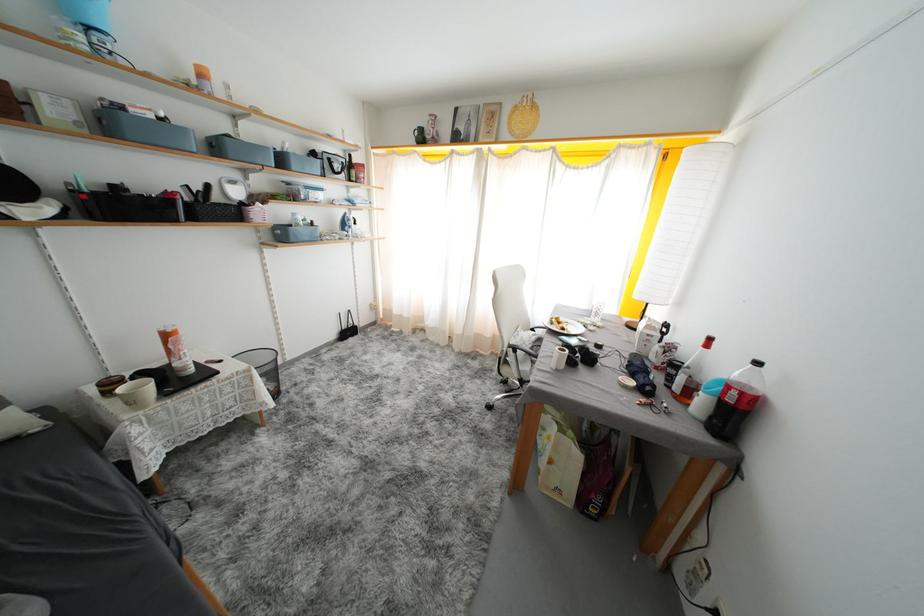
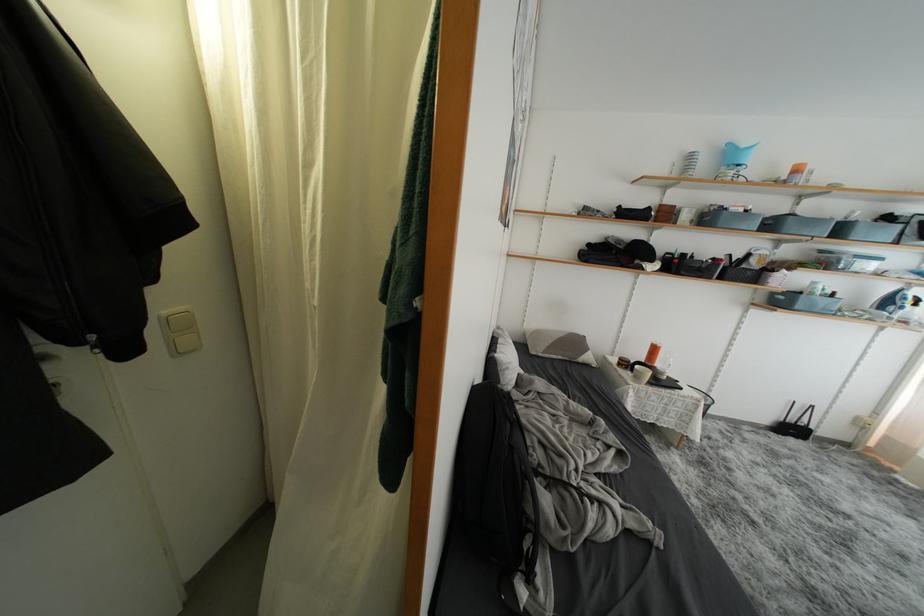
Where in the second image is the point corresponding to pixel 288 164 from the first image?

(847, 235)